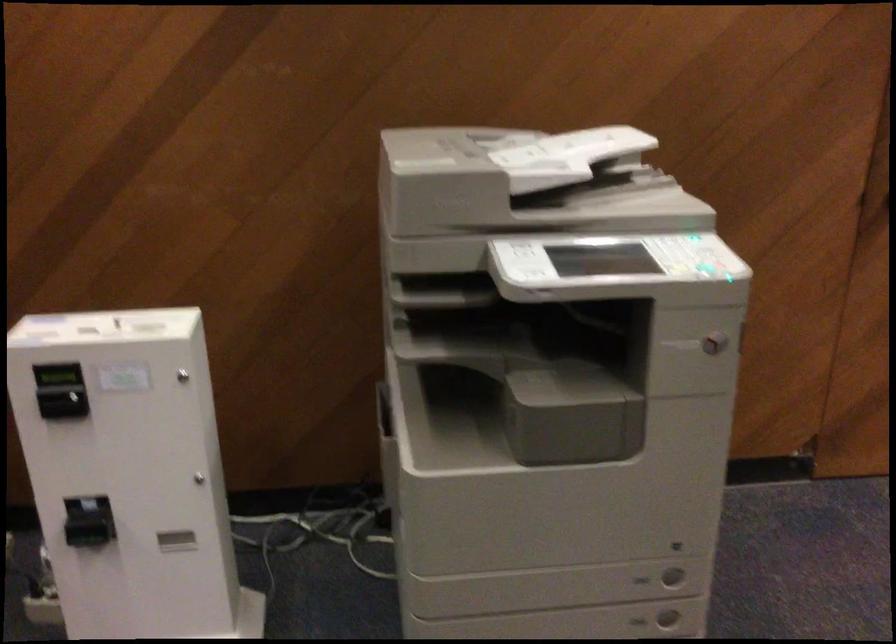
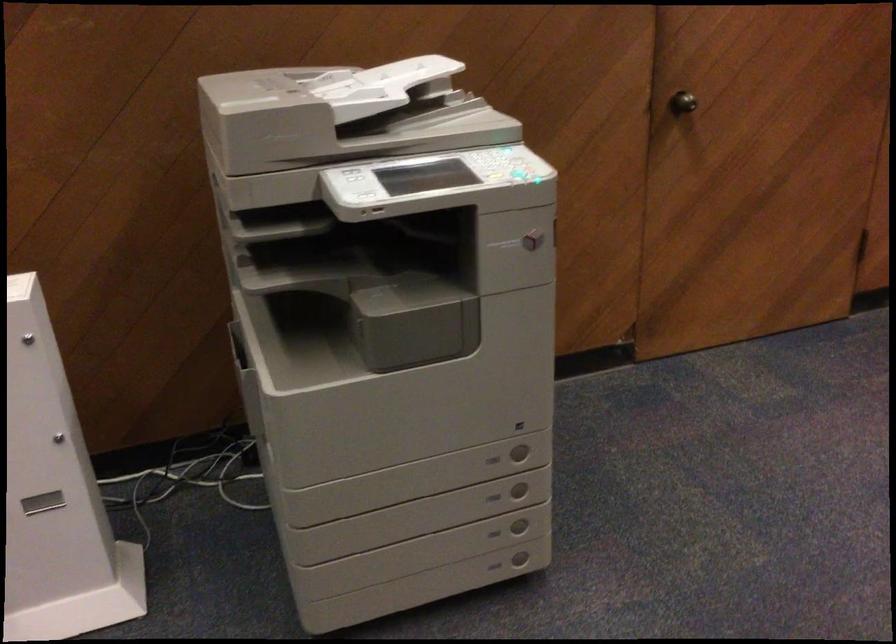
Locate, in the second image, the point that corresponds to point (626, 158) in the first image.

(437, 86)